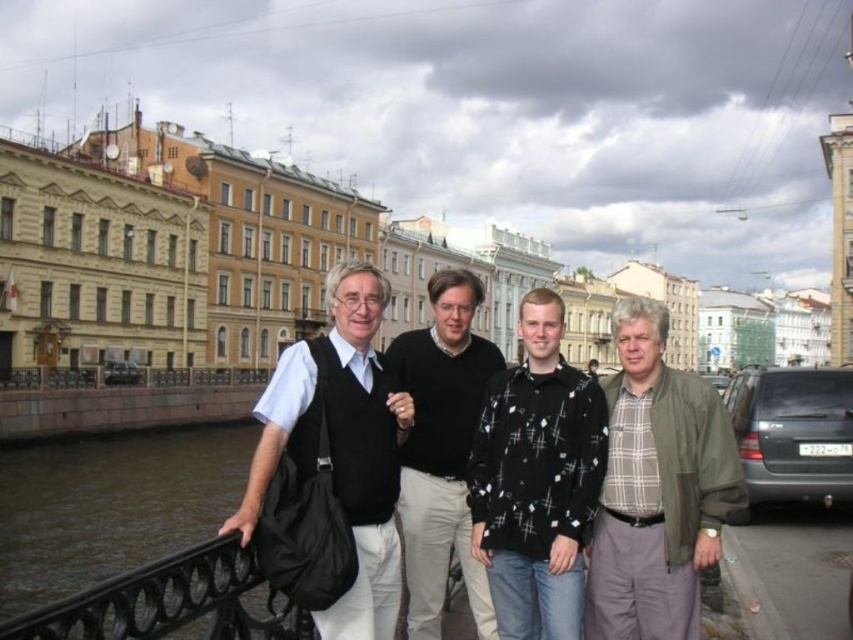
You are a photographer trying to capture the group of people on the bridge. You notice the black sweater at center and the black wrought iron railing at lower left in your viewfinder. Which object is positioned to the right side of the other?

The black sweater at center is to the right of the black wrought iron railing at lower left.

You are a fashion designer observing the two black garments at the center of the scene. Which one has a larger size between the black woven shirt at center and the matte black vest at center?

The matte black vest at center is larger than the black woven shirt at center.